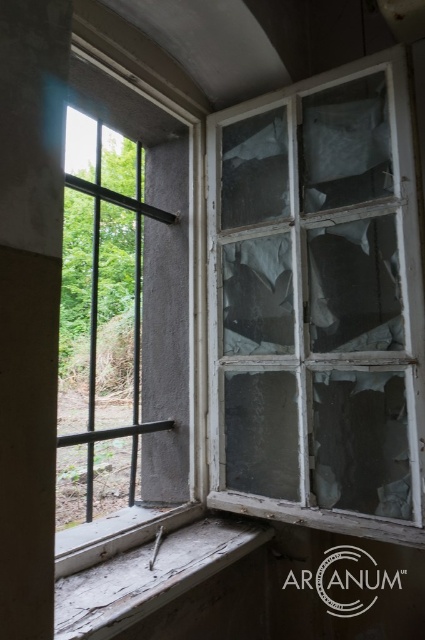
You are standing in the room depicted in the scene. There is a point at coordinates (317, 305). What object is located at this point?

The point at coordinates (317, 305) corresponds to the transparent glass window at right.

You are a repair worker assessing the damage in this room. You see the transparent glass window at right and the weathered wood at lower left. Which object is positioned higher from the ground?

The transparent glass window at right is located above the weathered wood at lower left, so it is positioned higher from the ground.